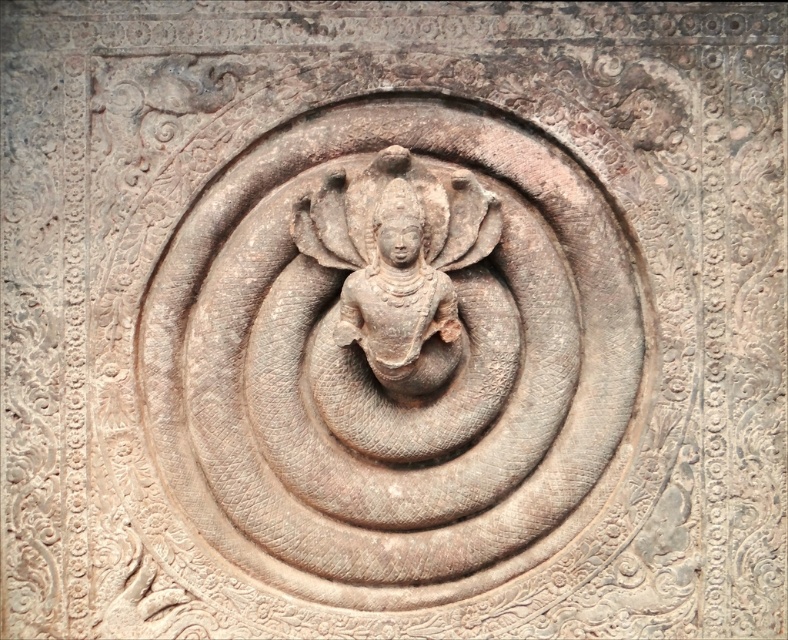
You are an archaeologist examining the stone carving. What is the exact 2D coordinate of the rustic stone carving at center?

The rustic stone carving at center is located at the 2D coordinate point of (391, 353).

You are an art historian examining the stone carving. You notice the rustic stone carving at center and the rustic stone deity at center. Which one is positioned lower in the image?

The rustic stone carving at center is located below the rustic stone deity at center, so it is positioned lower in the image.

You are an art conservator examining the rustic stone carving at center and the rustic stone deity at center. Which object has a greater width?

The rustic stone carving at center has a greater width than the rustic stone deity at center.